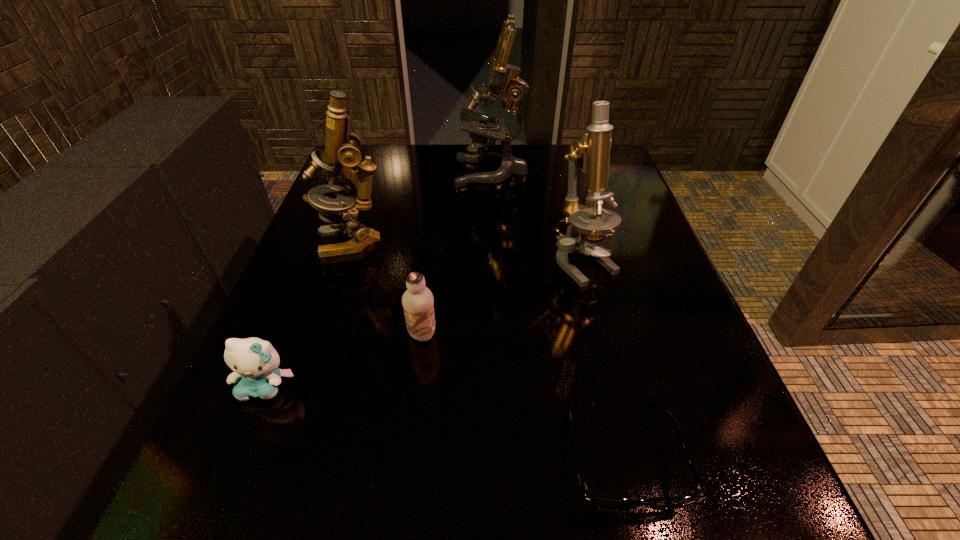
Identify the location of free location located 0.070m at the eyepieces of the farthest object. The width and height of the screenshot is (960, 540). (428, 171).

The width and height of the screenshot is (960, 540). What are the coordinates of `free space located on the left of the rightmost microscope` in the screenshot? It's located at (507, 262).

In order to click on blank space located 0.140m on the right of the leftmost microscope in this screenshot , I will do `click(453, 241)`.

You are a GUI agent. You are given a task and a screenshot of the screen. Output one action in this format:
    pyautogui.click(x=<x>, y=<y>)
    Task: Click on the vacant space located 0.170m on the left of the third shortest object
    The width and height of the screenshot is (960, 540).
    Given the screenshot: What is the action you would take?
    pyautogui.click(x=307, y=334)

Locate an element on the screen. free region located 0.060m on the face of the fifth tallest object is located at coordinates (241, 444).

This screenshot has width=960, height=540. In order to click on object at the far edge in this screenshot , I will do `click(502, 77)`.

This screenshot has width=960, height=540. Identify the location of object present at the near edge. (599, 501).

Identify the location of microscope that is at the left edge. The width and height of the screenshot is (960, 540). (341, 153).

You are a GUI agent. You are given a task and a screenshot of the screen. Output one action in this format:
    pyautogui.click(x=<x>, y=<y>)
    Task: Click on the kitten that is at the left edge
    
    Given the screenshot: What is the action you would take?
    pyautogui.click(x=255, y=362)

Where is `microscope that is at the right edge`? This screenshot has height=540, width=960. microscope that is at the right edge is located at coordinates (585, 225).